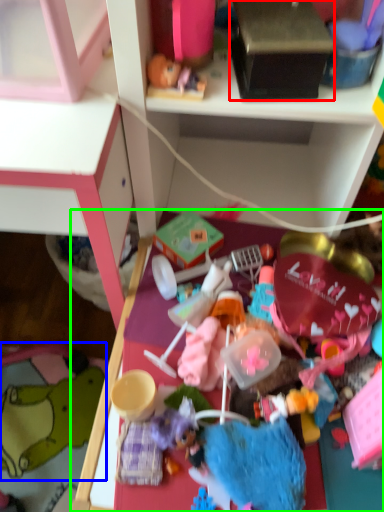
Question: Which object is positioned closest to box (highlighted by a red box)? Select from toy (highlighted by a blue box) and table (highlighted by a green box).

Choices:
 (A) toy
 (B) table

Answer: (B)